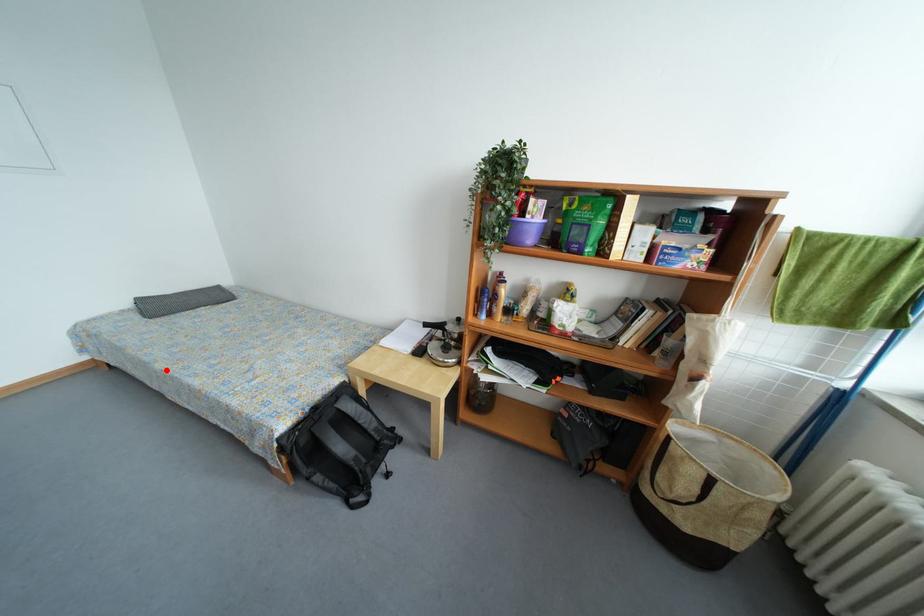
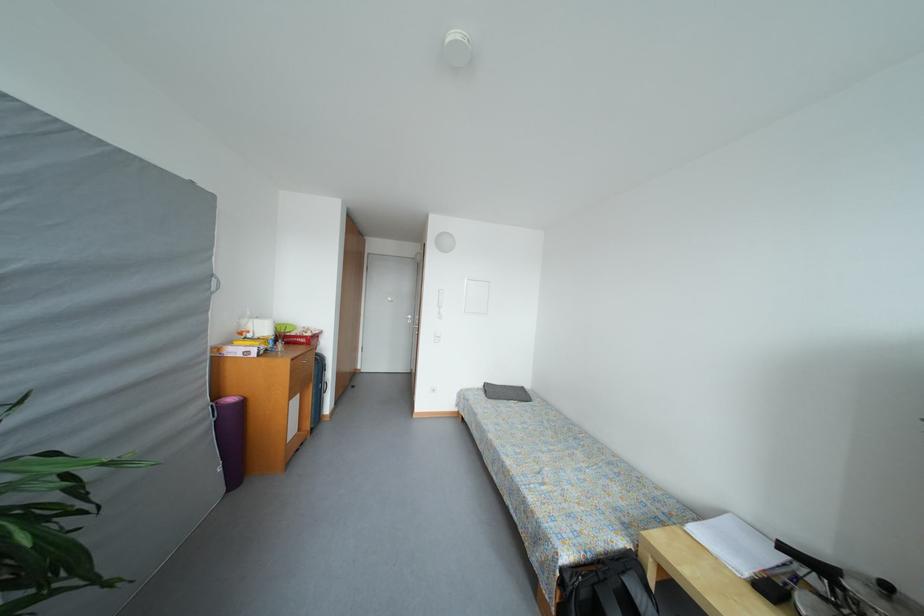
Where in the second image is the point corresponding to the highlighted location from the first image?

(496, 440)